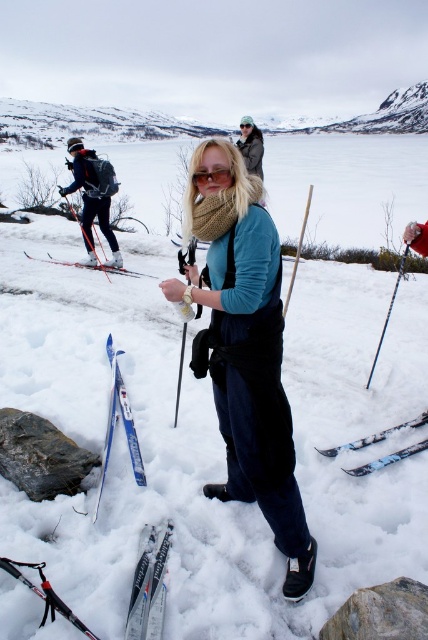
Who is taller, matte black ski pole at lower left or matte black goggles at center?

With more height is matte black goggles at center.

Who is more distant from viewer, (79, 625) or (249, 120)?

The point (249, 120) is behind.

I want to click on matte black ski pole at lower left, so click(x=44, y=593).

Where is `light brown fur coat at center`? The image size is (428, 640). light brown fur coat at center is located at coordinates (252, 148).

How distant is light brown fur coat at center from clear plastic goggles at center?

3.22 meters

In the scene shown: Who is more distant from viewer, (253, 160) or (210, 173)?

Positioned behind is point (253, 160).

Locate an element on the screen. light brown fur coat at center is located at coordinates (252, 148).

Which of these two, knitted wool scarf at center or clear plastic goggles at center, stands taller?

knitted wool scarf at center

Is knitted wool scarf at center closer to the viewer compared to clear plastic goggles at center?

Yes, knitted wool scarf at center is in front of clear plastic goggles at center.

Is point (262, 403) positioned in front of point (205, 176)?

That is False.

You are a GUI agent. You are given a task and a screenshot of the screen. Output one action in this format:
    pyautogui.click(x=<x>, y=<y>)
    Task: Click on the knitted wool scarf at center
    The image size is (428, 640).
    Given the screenshot: What is the action you would take?
    [x=244, y=349]